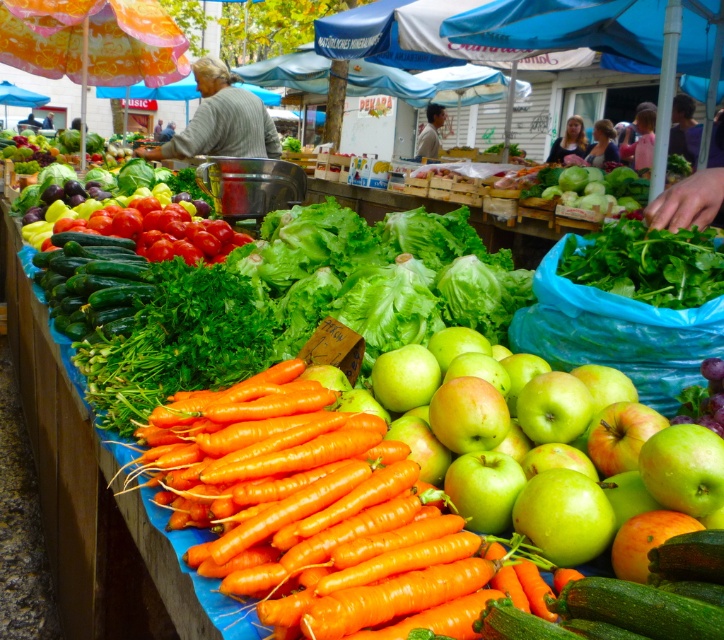
Is point (248, 531) more distant than point (628, 243)?

No, (248, 531) is in front of (628, 243).

Can you confirm if orange smooth carrots at center is positioned below green leafy at center?

Indeed, orange smooth carrots at center is positioned under green leafy at center.

What do you see at coordinates (321, 522) in the screenshot? This screenshot has width=724, height=640. I see `orange smooth carrots at center` at bounding box center [321, 522].

The width and height of the screenshot is (724, 640). I want to click on orange smooth carrots at center, so (x=321, y=522).

Does point (350, 467) come closer to viewer compared to point (686, 458)?

No, it is behind (686, 458).

Which is in front, point (306, 634) or point (696, 497)?

Point (306, 634) is more forward.

Describe the element at coordinates (321, 522) in the screenshot. Image resolution: width=724 pixels, height=640 pixels. I see `orange smooth carrots at center` at that location.

I want to click on orange smooth carrots at center, so click(321, 522).

Where is `green matte apple at center`? This screenshot has height=640, width=724. green matte apple at center is located at coordinates (547, 444).

Where is `green matte apple at center`? The width and height of the screenshot is (724, 640). green matte apple at center is located at coordinates (547, 444).